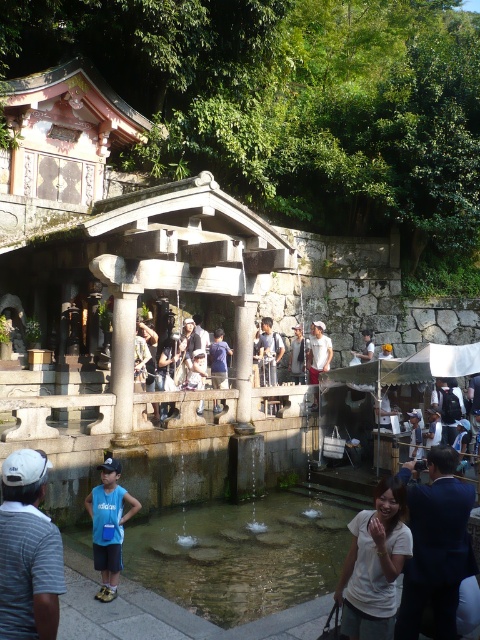
Is clear water at fountain center wider than blue fabric shirt at center?

Indeed, clear water at fountain center has a greater width compared to blue fabric shirt at center.

Is point (243, 504) in front of point (100, 540)?

No.

Find the location of a particular element. clear water at fountain center is located at coordinates (243, 552).

At what (x,y) coordinates should I click in order to perform the action: click on clear water at fountain center. Please return your answer as a coordinate pair (x, y). This screenshot has height=640, width=480. Looking at the image, I should click on (243, 552).

Who is taller, white cotton shirt at lower right or blue fabric shirt at center?

white cotton shirt at lower right

Does point (440, 483) lie behind point (105, 600)?

No.

In order to click on white cotton shirt at lower right in this screenshot , I will do `click(435, 545)`.

Who is taller, white striped shirt at lower left or blue fabric shirt at center?

Standing taller between the two is blue fabric shirt at center.

Is point (52, 554) behind point (117, 520)?

No.

Which is behind, point (6, 609) or point (100, 584)?

The point (100, 584) is more distant.

You are a GUI agent. You are given a task and a screenshot of the screen. Output one action in this format:
    pyautogui.click(x=<x>, y=<y>)
    Task: Click on the white striped shirt at lower left
    Image resolution: width=480 pixels, height=640 pixels.
    Given the screenshot: What is the action you would take?
    pyautogui.click(x=27, y=552)